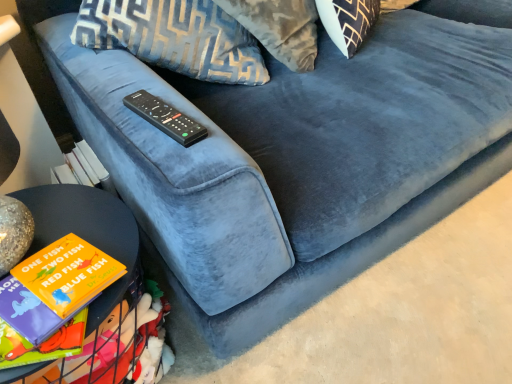
You are a GUI agent. You are given a task and a screenshot of the screen. Output one action in this format:
    pyautogui.click(x=<x>, y=<y>)
    Task: Click on the free point behind matte black table at lower left
    This screenshot has width=512, height=384.
    Given the screenshot: What is the action you would take?
    pyautogui.click(x=71, y=211)